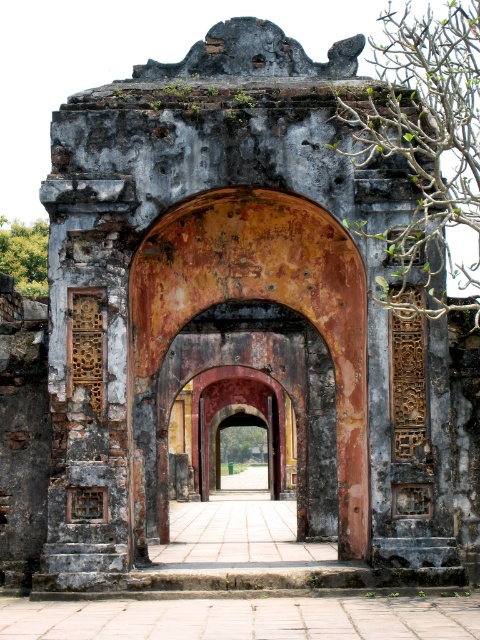
You are standing at the base of the ancient stone archway and want to take a photo that includes both the archway and the green leafy tree at upper left. Given that your camera has a maximum zoom range of 100 meters, will you be able to capture both in a single frame without moving closer?

The green leafy tree at upper left is 141.58 meters away from the camera. Since your camera can only zoom up to 100 meters, you wonot be able to capture both the archway and the tree in a single frame without moving closer.

You are standing in front of the ancient stone archway and want to take a photo of the green leafy branches at upper right and the rustic stone pathway at center. Which object should you focus on first to ensure both are in the frame?

You should focus on the green leafy branches at upper right first because it is closer to the viewer, ensuring both it and the rustic stone pathway at center will be in the frame.

You are an architect analyzing the proportions of this historical site. Given the green leafy branches at upper right and the rustic stone pathway at center, which object has a greater width?

The green leafy branches at upper right have a greater width than the rustic stone pathway at center.